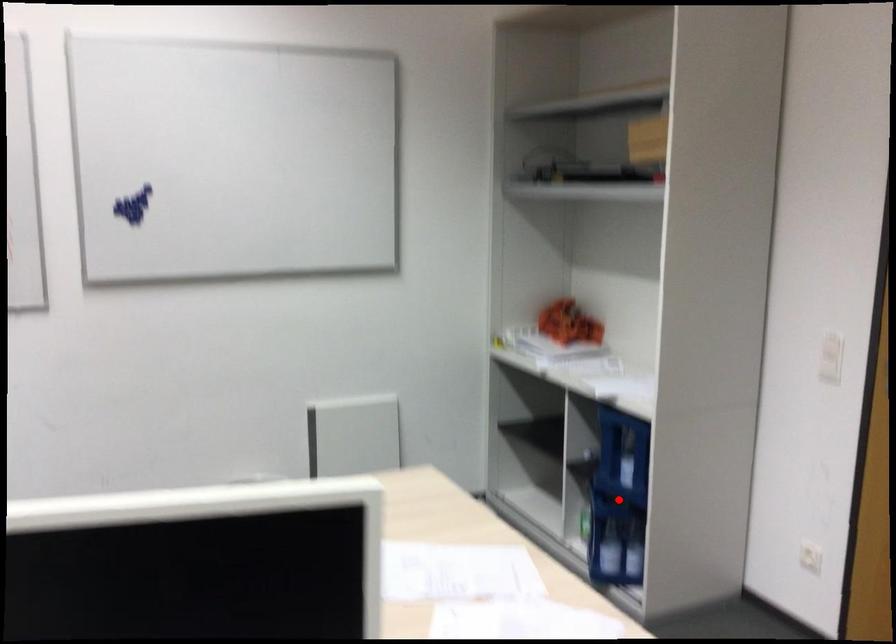
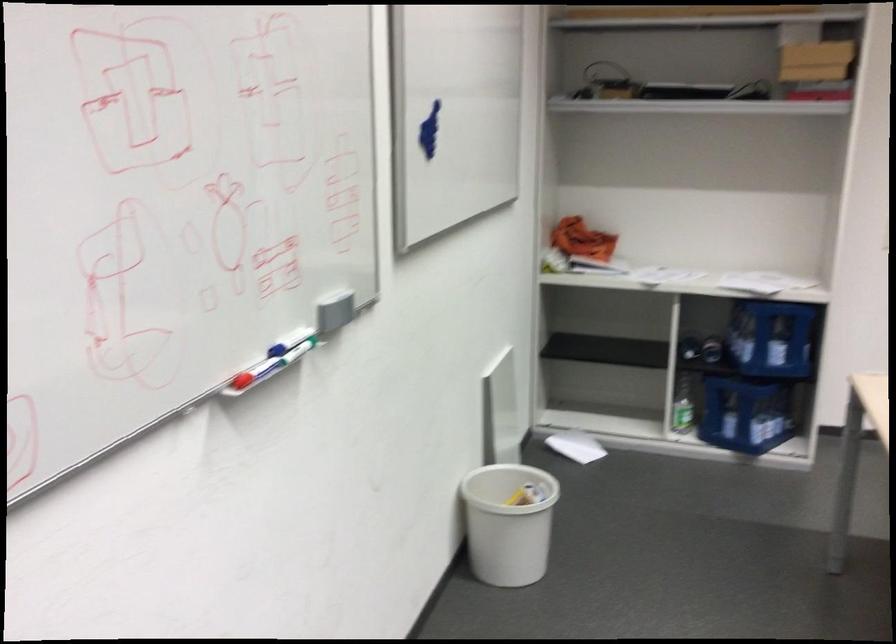
Question: I am providing you with two images of the same scene from different viewpoints. A red point is marked on the first image. At the location where the point appears in image 1, is it still visible in image 2?

Choices:
 (A) Yes
 (B) No

Answer: (B)